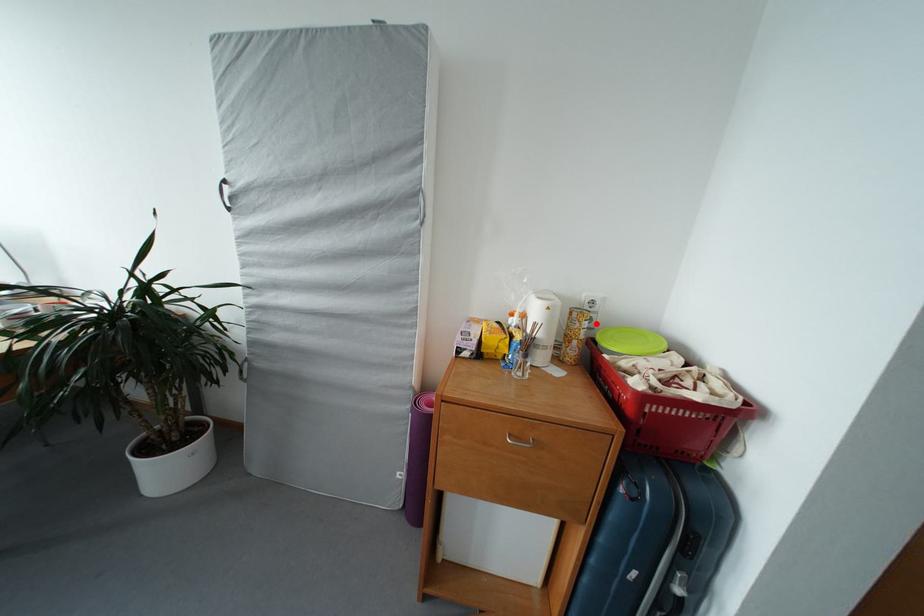
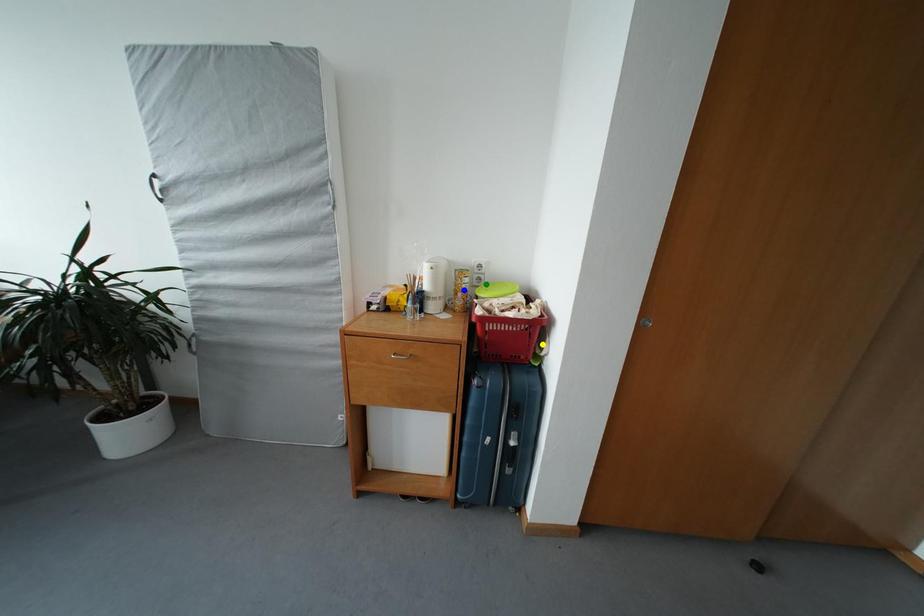
Question: I am providing you with two images of the same scene from different viewpoints. A red point is marked on the first image. You are given multiple points on the second image. In image 2, which mark is for the same physical point as the one in image 1?

Choices:
 (A) yellow point
 (B) green point
 (C) blue point

Answer: (B)